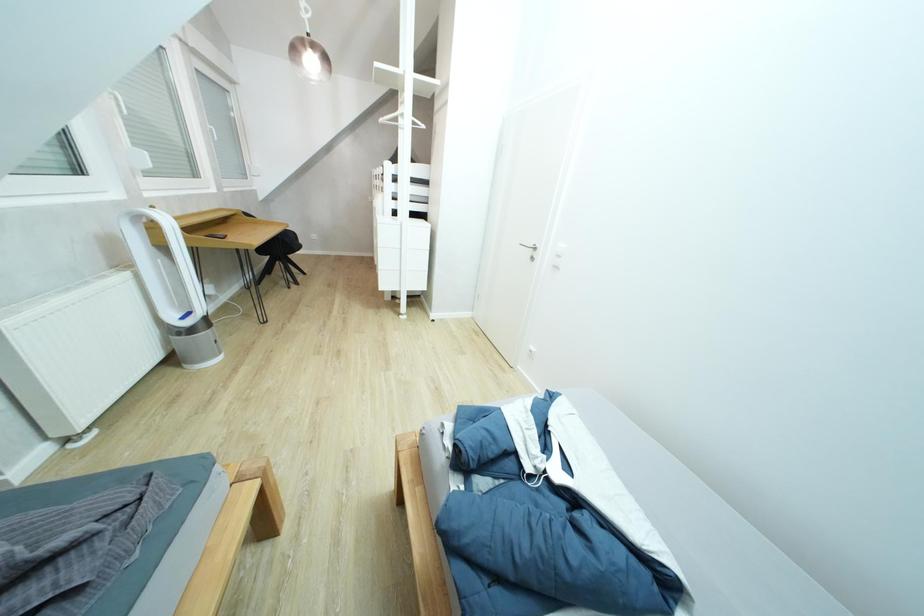
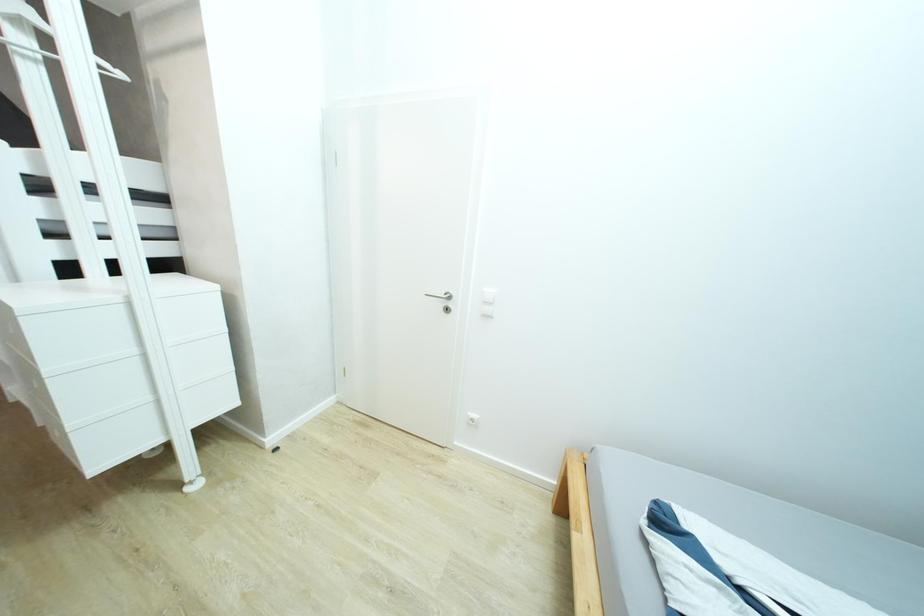
Question: The first image is from the beginning of the video and the second image is from the end. How did the camera likely rotate when shooting the video?

Choices:
 (A) Left
 (B) Right
 (C) Up
 (D) Down

Answer: (B)